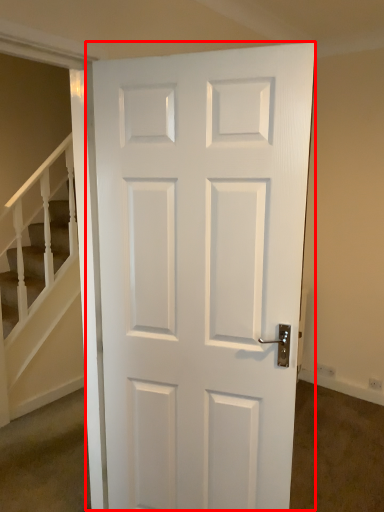
Question: From the image's perspective, where is door (annotated by the red box) located relative to stairwell?

Choices:
 (A) above
 (B) below

Answer: (A)